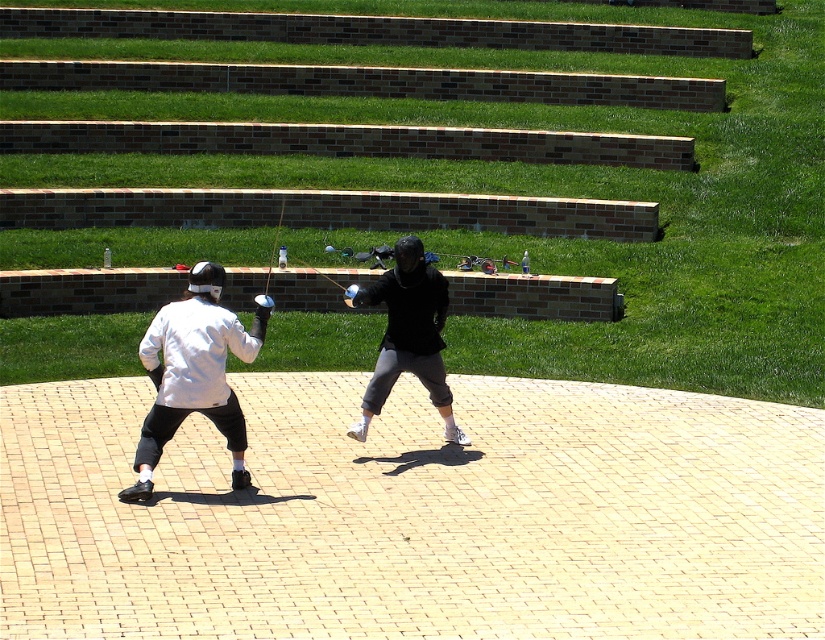
This screenshot has height=640, width=825. I want to click on white matte fencing gear at center, so click(192, 376).

Can you confirm if white matte fencing gear at center is positioned above white matte jacket at center?

No, white matte fencing gear at center is not above white matte jacket at center.

Measure the distance between white matte fencing gear at center and camera.

white matte fencing gear at center and camera are 11.63 meters apart.

Does point (437, 301) come behind point (149, 419)?

Yes, it is behind point (149, 419).

Where is `white matte fencing gear at center`? white matte fencing gear at center is located at coordinates (192, 376).

Is point (184, 365) farther from viewer compared to point (423, 342)?

No, it is not.

Describe the element at coordinates (194, 372) in the screenshot. This screenshot has height=640, width=825. I see `white matte jacket at center` at that location.

Identify the location of white matte jacket at center. (194, 372).